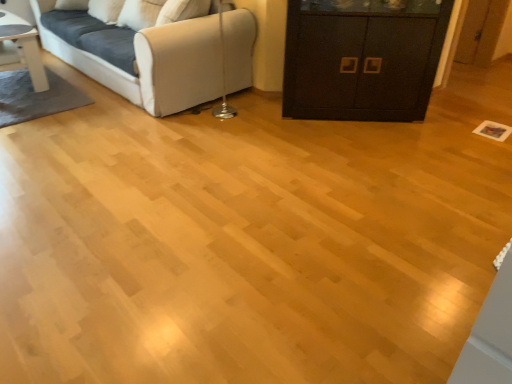
Question: Is point (81, 19) positioned closer to the camera than point (6, 33)?

Choices:
 (A) closer
 (B) farther

Answer: (B)

Question: From a real-world perspective, is white fabric couch at upper left positioned above or below white glossy table at upper left?

Choices:
 (A) below
 (B) above

Answer: (B)

Question: Which of these objects is positioned farthest from the black matte cabinet at center?

Choices:
 (A) white glossy table at upper left
 (B) white fabric couch at upper left

Answer: (A)

Question: Estimate the real-world distances between objects in this image. Which object is farther from the white glossy table at upper left?

Choices:
 (A) white fabric couch at upper left
 (B) black matte cabinet at center

Answer: (B)